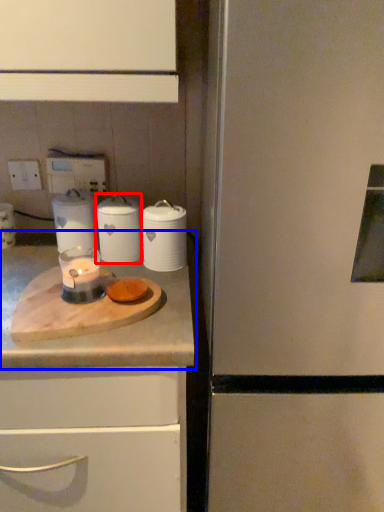
Question: Which object appears farthest to the camera in this image, kitchen appliance (highlighted by a red box) or countertop (highlighted by a blue box)?

Choices:
 (A) kitchen appliance
 (B) countertop

Answer: (A)